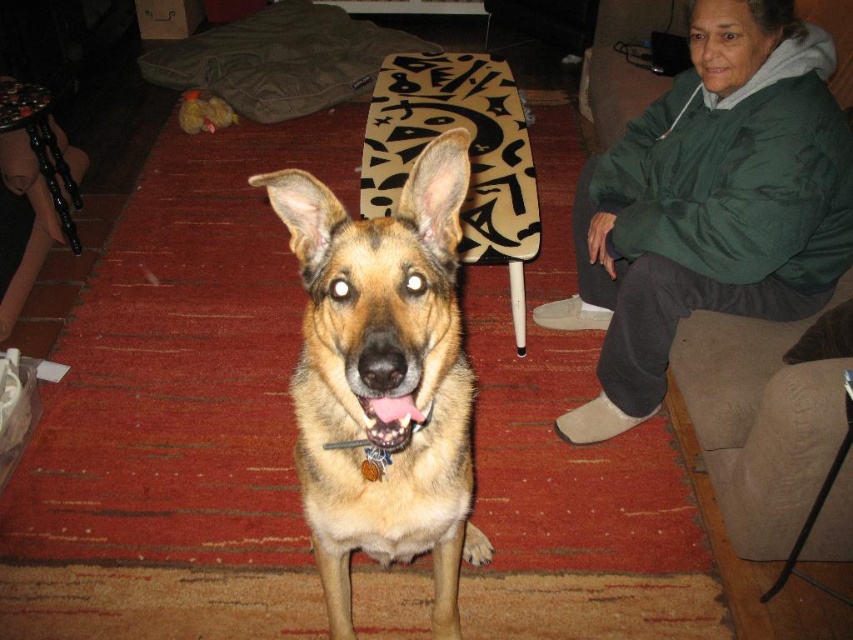
Looking at this image, measure the distance between golden fur dog at center and pink glossy teeth at center.

golden fur dog at center is 9.60 inches away from pink glossy teeth at center.

Between golden fur dog at center and pink glossy teeth at center, which one is positioned lower?

golden fur dog at center

Which is behind, point (469, 476) or point (387, 420)?

The point (469, 476) is behind.

Locate an element on the screen. Image resolution: width=853 pixels, height=640 pixels. golden fur dog at center is located at coordinates (383, 376).

The height and width of the screenshot is (640, 853). Identify the location of green fleece jacket at upper right. (709, 204).

Based on the photo, who is lower down, green fleece jacket at upper right or golden fur dog at center?

Positioned lower is golden fur dog at center.

What do you see at coordinates (709, 204) in the screenshot?
I see `green fleece jacket at upper right` at bounding box center [709, 204].

Where is `green fleece jacket at upper right`? The width and height of the screenshot is (853, 640). green fleece jacket at upper right is located at coordinates (x=709, y=204).

Who is positioned more to the right, green fleece jacket at upper right or pink glossy teeth at center?

Positioned to the right is green fleece jacket at upper right.

Is green fleece jacket at upper right closer to the viewer compared to pink glossy teeth at center?

No, it is not.

Where is `green fleece jacket at upper right`? green fleece jacket at upper right is located at coordinates (709, 204).